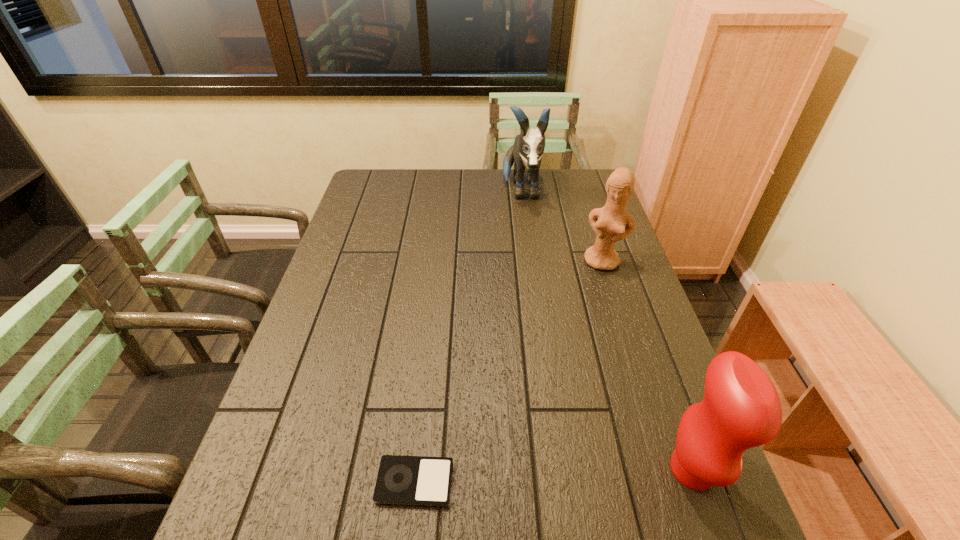
Where is `free location that satisfies the following two spatial constraints: 1. on the back side of the leftmost object; 2. on the label side of the condiment`? This screenshot has width=960, height=540. free location that satisfies the following two spatial constraints: 1. on the back side of the leftmost object; 2. on the label side of the condiment is located at coordinates (416, 469).

The image size is (960, 540). I want to click on free space that satisfies the following two spatial constraints: 1. on the front side of the figurine; 2. on the left side of the third object from right to left, so click(x=531, y=261).

The height and width of the screenshot is (540, 960). I want to click on vacant space that satisfies the following two spatial constraints: 1. on the front side of the third nearest object; 2. on the left side of the tallest object, so click(x=531, y=261).